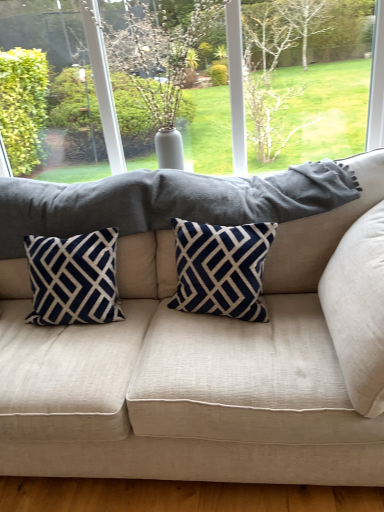
Question: Considering their positions, is beige fabric couch at center located in front of or behind navy velvet pillow at left, arranged as the 1th pillow when viewed from the left?

Choices:
 (A) behind
 (B) front

Answer: (B)

Question: Is beige fabric couch at center bigger or smaller than navy velvet pillow at left, arranged as the 1th pillow when viewed from the left?

Choices:
 (A) big
 (B) small

Answer: (A)

Question: Which of these objects is positioned farthest from the navy blue velvet pillow at center, the 2th pillow in the right-to-left sequence?

Choices:
 (A) green leafy tree at upper center
 (B) navy velvet pillow at left, arranged as the 1th pillow when viewed from the left
 (C) beige fabric couch at center
 (D) beige fabric pillow at right, which ranks as the 3th pillow in left-to-right order

Answer: (A)

Question: Which of these objects is positioned closest to the green leafy tree at upper center?

Choices:
 (A) beige fabric couch at center
 (B) navy blue velvet pillow at center, placed as the second pillow when sorted from left to right
 (C) beige fabric pillow at right, which ranks as the 3th pillow in left-to-right order
 (D) navy velvet pillow at left, which ranks as the 3th pillow in right-to-left order

Answer: (D)